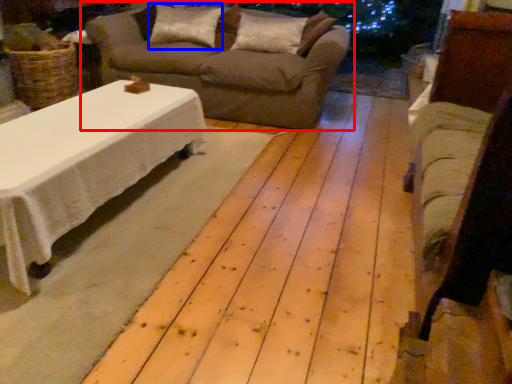
Question: Which object appears farthest to the camera in this image, studio couch (highlighted by a red box) or pillow (highlighted by a blue box)?

Choices:
 (A) studio couch
 (B) pillow

Answer: (B)